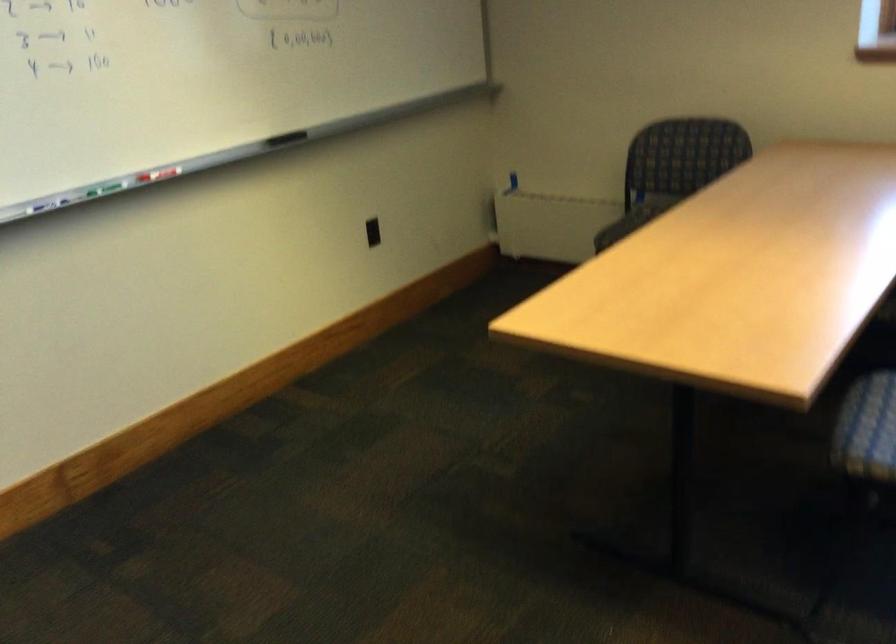
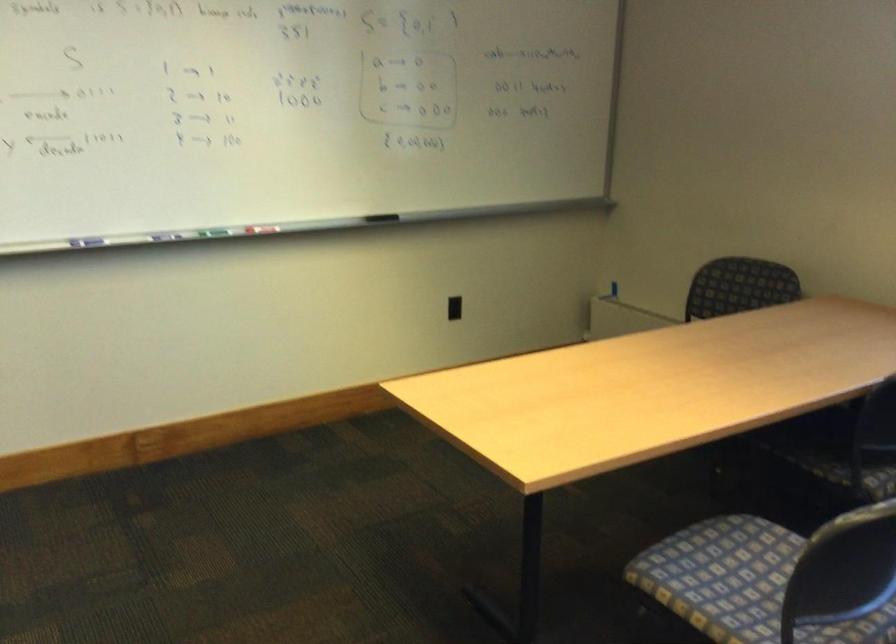
Question: The camera is either moving clockwise (left) or counter-clockwise (right) around the object. The first image is from the beginning of the video and the second image is from the end. Is the camera moving left or right when shooting the video?

Choices:
 (A) Left
 (B) Right

Answer: (B)